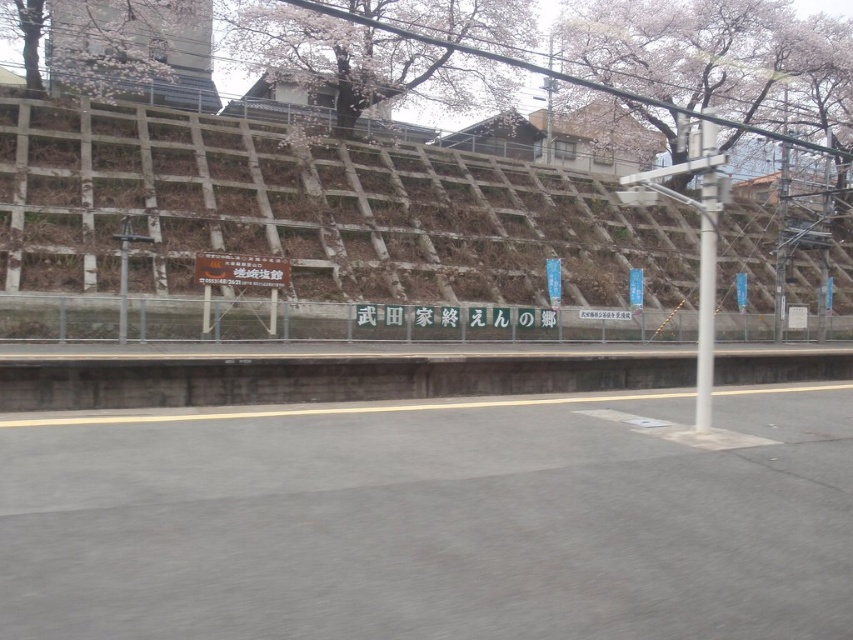
You are a tourist visiting the train station and want to take a photo of the brown textured wall at upper center and the slightly fuzzy cherry blossom at upper center. Which object should you focus on first if you want both to be in focus without moving the camera?

The brown textured wall at upper center is bigger than the slightly fuzzy cherry blossom at upper center, so you should focus on the brown textured wall at upper center first to ensure both are in focus.

You are standing on the train station platform and looking towards the embankment. Which object at upper center is larger in size between the brown textured wall at upper center and the cherry blossom tree at upper center?

The brown textured wall at upper center is bigger than the cherry blossom tree at upper center according to the description.